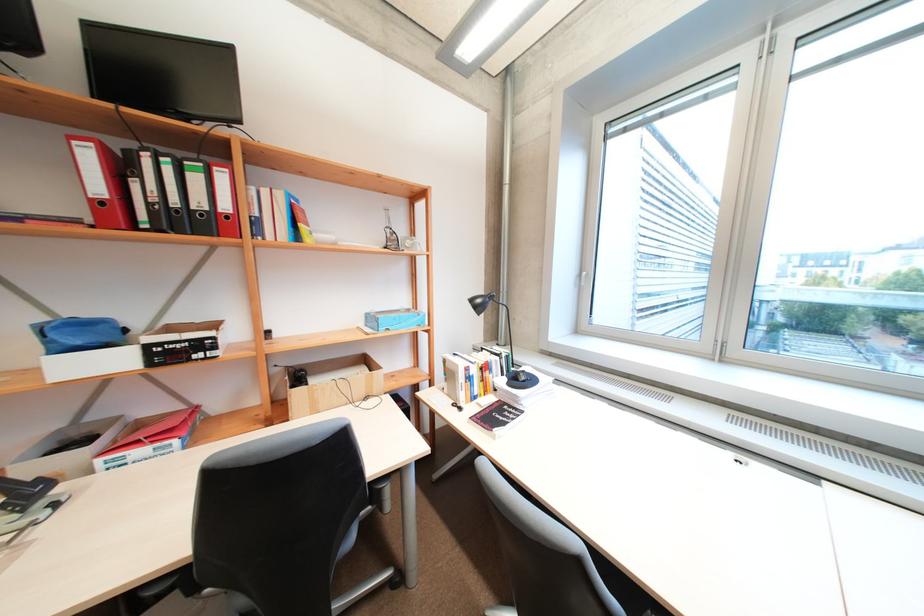
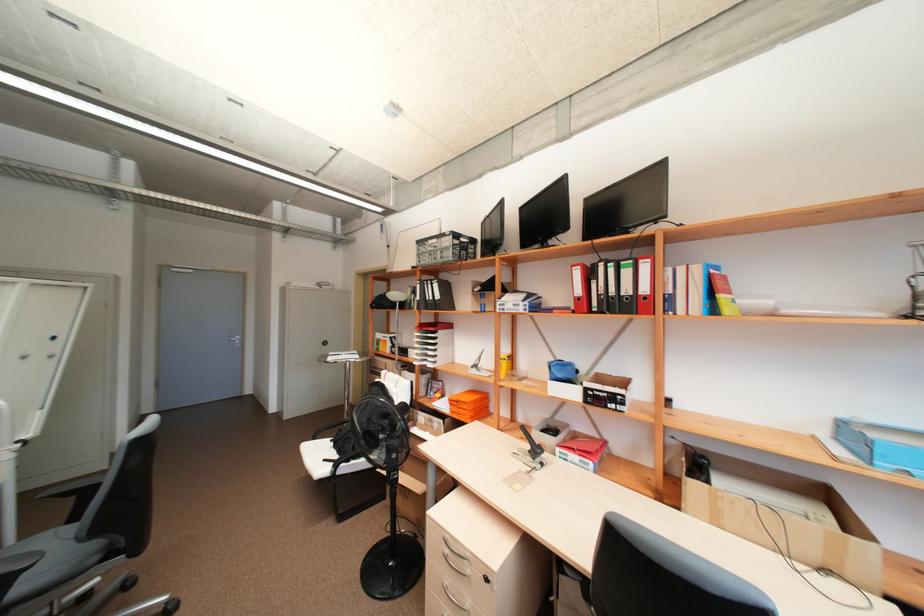
Where in the second image is the point corresponding to [141,442] from the first image?

(578, 448)